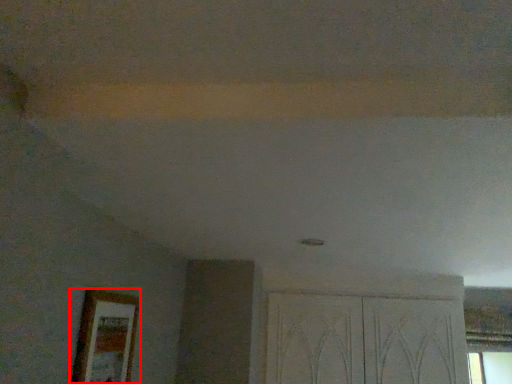
Question: From the image's perspective, what is the correct spatial positioning of picture frame (annotated by the red box) in reference to screen door?

Choices:
 (A) above
 (B) below

Answer: (A)